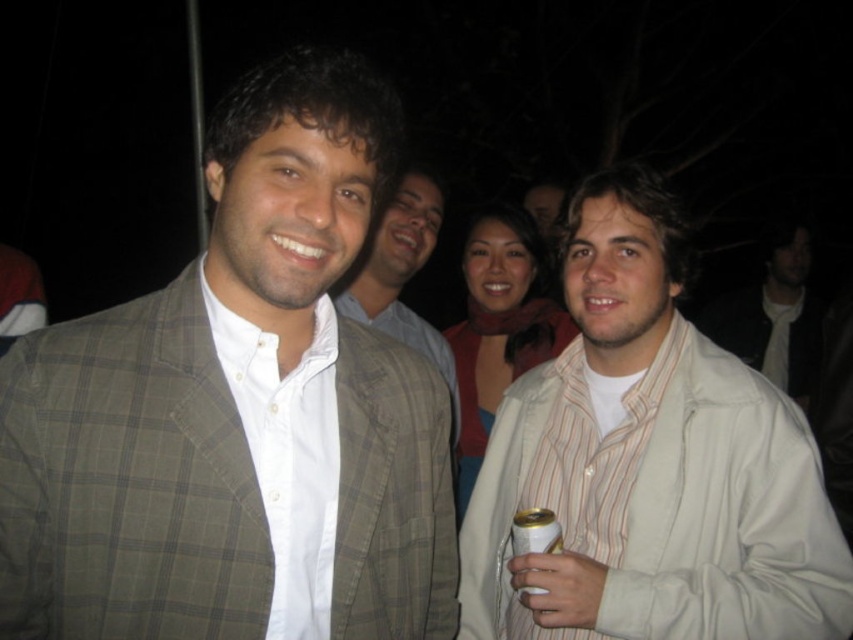
Question: Is white striped shirt at right in front of white cotton shirt at center?

Choices:
 (A) yes
 (B) no

Answer: (A)

Question: Which of the following is the farthest from the observer?

Choices:
 (A) plaid wool blazer at center
 (B) white striped shirt at right
 (C) gold metallic can at lower center

Answer: (C)

Question: Considering the real-world distances, which object is closest to the white cotton shirt at center?

Choices:
 (A) gold metallic can at lower center
 (B) plaid wool blazer at center

Answer: (B)

Question: Can you confirm if white striped shirt at right is smaller than gold metallic can at lower center?

Choices:
 (A) no
 (B) yes

Answer: (A)

Question: Considering the real-world distances, which object is closest to the white cotton shirt at center?

Choices:
 (A) matte gray suit at center
 (B) gold metallic can at lower center
 (C) white striped shirt at right
 (D) plaid wool blazer at center

Answer: (A)

Question: Can you confirm if plaid wool blazer at center is positioned below white striped shirt at right?

Choices:
 (A) yes
 (B) no

Answer: (B)